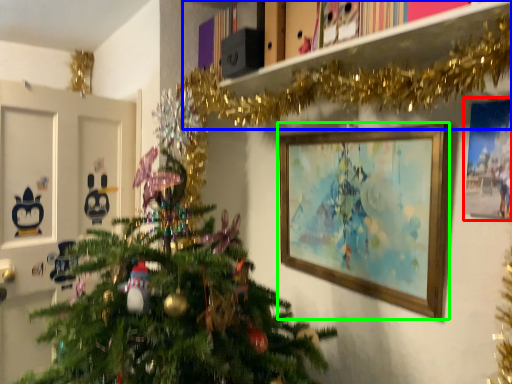
Question: Estimate the real-world distances between objects in this image. Which object is farther from picture frame (highlighted by a red box), bookshelf (highlighted by a blue box) or picture frame (highlighted by a green box)?

Choices:
 (A) bookshelf
 (B) picture frame

Answer: (A)